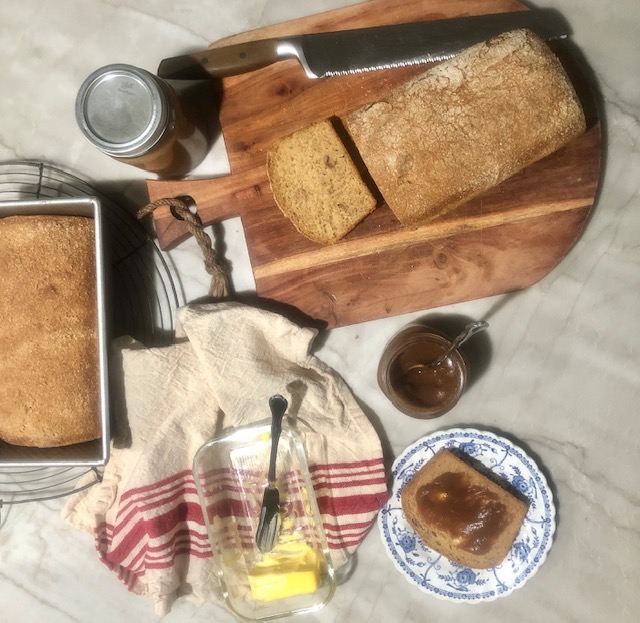
Locate an element on the screen. This screenshot has height=623, width=640. wooden serving board is located at coordinates (476, 232).